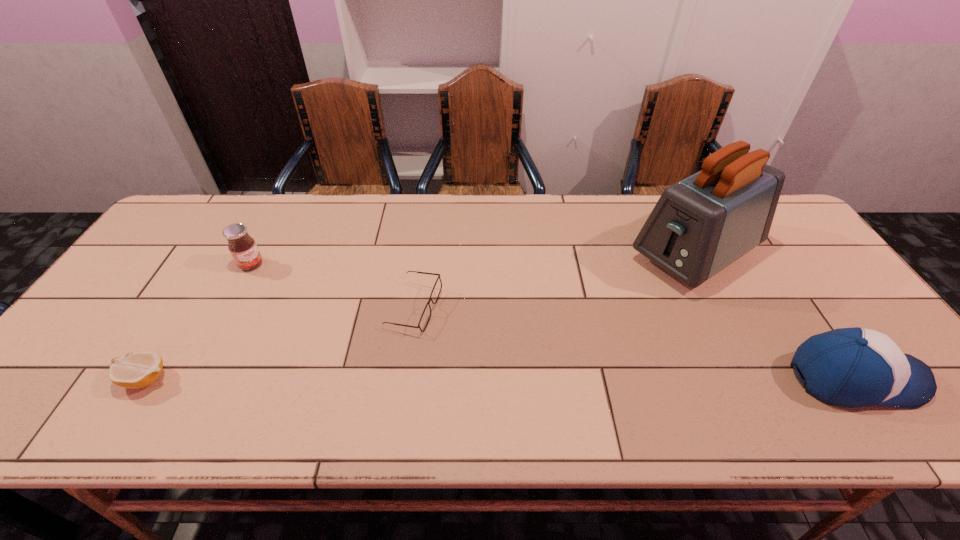
The height and width of the screenshot is (540, 960). In order to click on lemon in this screenshot , I will do `click(138, 369)`.

This screenshot has width=960, height=540. I want to click on baseball cap, so click(854, 367).

The width and height of the screenshot is (960, 540). I want to click on the third object from left to right, so click(x=426, y=315).

The image size is (960, 540). I want to click on jam, so click(x=243, y=248).

Find the location of a particular element. toaster is located at coordinates (700, 225).

Where is `vacant region located 0.070m on the back of the lemon`? This screenshot has width=960, height=540. vacant region located 0.070m on the back of the lemon is located at coordinates (171, 338).

You are a GUI agent. You are given a task and a screenshot of the screen. Output one action in this format:
    pyautogui.click(x=<x>, y=<y>)
    Task: Click on the free location located 0.180m with the lenses facing outward on the spectacles
    The image size is (960, 540).
    Given the screenshot: What is the action you would take?
    pyautogui.click(x=486, y=369)

In order to click on vacant space located with the lenses facing outward on the spectacles in this screenshot , I will do (x=509, y=387).

Identify the location of free space located 0.140m with the lenses facing outward on the spectacles. The image size is (960, 540). (473, 359).

Locate an element on the screen. The image size is (960, 540). vacant region located 0.210m on the label side of the jam is located at coordinates (302, 305).